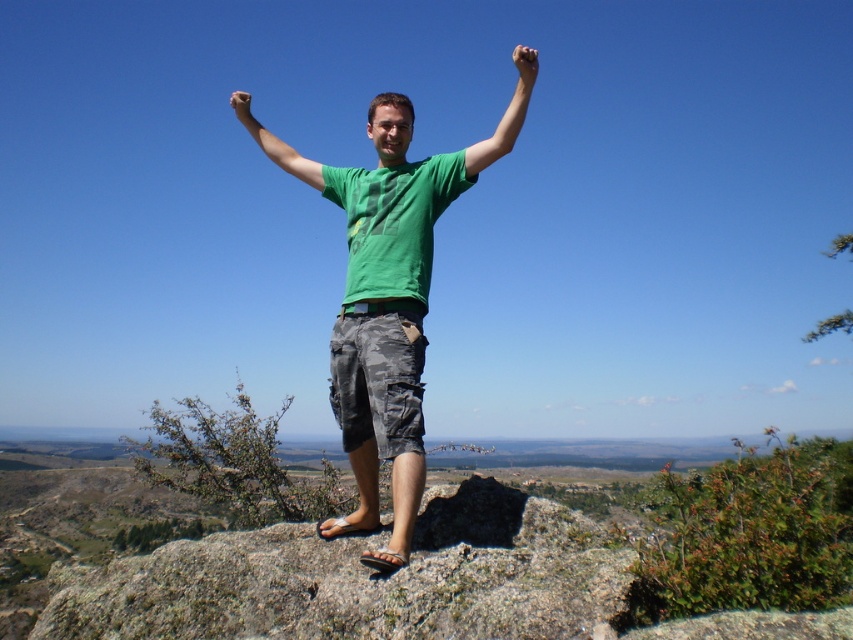
Is gray rough rock at center to the right of matte black hand at upper center from the viewer's perspective?

In fact, gray rough rock at center is to the left of matte black hand at upper center.

You are a GUI agent. You are given a task and a screenshot of the screen. Output one action in this format:
    pyautogui.click(x=<x>, y=<y>)
    Task: Click on the gray rough rock at center
    This screenshot has height=640, width=853.
    Given the screenshot: What is the action you would take?
    pyautogui.click(x=361, y=579)

Image resolution: width=853 pixels, height=640 pixels. I want to click on gray rough rock at center, so click(x=361, y=579).

Locate an element on the screen. This screenshot has height=640, width=853. gray rough rock at center is located at coordinates (361, 579).

Is point (506, 148) positioned behind point (267, 145)?

That is False.

From the picture: Can you confirm if green matte shirt at upper center is shorter than green matte shirt at center?

Yes.

Find the location of a particular element. green matte shirt at upper center is located at coordinates (505, 116).

Can you confirm if matte black hand at upper center is shorter than matte green shirt at center?

Correct, matte black hand at upper center is not as tall as matte green shirt at center.

Between point (524, 65) and point (248, 108), which one is positioned in front?

Positioned in front is point (524, 65).

This screenshot has height=640, width=853. In order to click on matte black hand at upper center in this screenshot , I will do `click(525, 64)`.